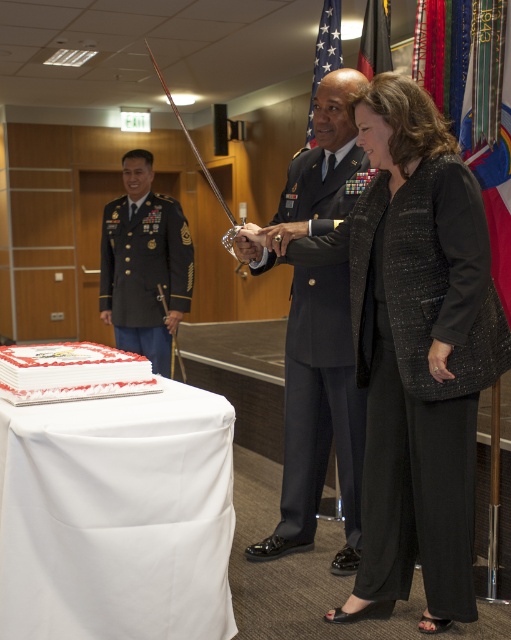
Question: Which object is positioned farthest from the black textured suit at center?

Choices:
 (A) white frosted cake at lower left
 (B) black textured pants at lower right
 (C) green military uniform at left
 (D) american flag at upper center

Answer: (C)

Question: Among these objects, which one is nearest to the camera?

Choices:
 (A) green military uniform at left
 (B) american flag at upper center

Answer: (B)

Question: Can you confirm if white cloth at lower left is smaller than green military uniform at left?

Choices:
 (A) no
 (B) yes

Answer: (A)

Question: Is black textured pants at lower right positioned before white frosted cake at lower left?

Choices:
 (A) yes
 (B) no

Answer: (B)

Question: Is black textured suit at center in front of green military uniform at left?

Choices:
 (A) no
 (B) yes

Answer: (B)

Question: Which point is closer to the camera?

Choices:
 (A) white frosted cake at lower left
 (B) american flag at upper center

Answer: (A)